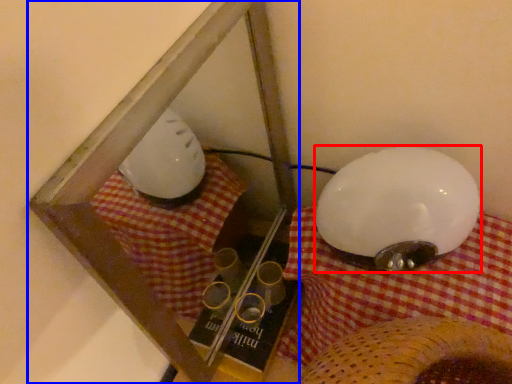
Question: Which point is further to the camera, lamp (highlighted by a red box) or glass box (highlighted by a blue box)?

Choices:
 (A) lamp
 (B) glass box

Answer: (A)